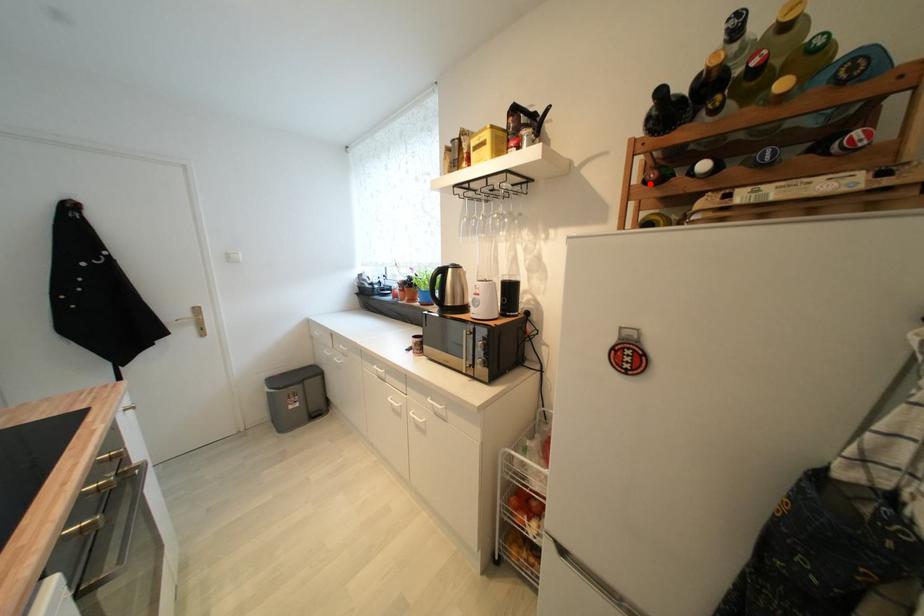
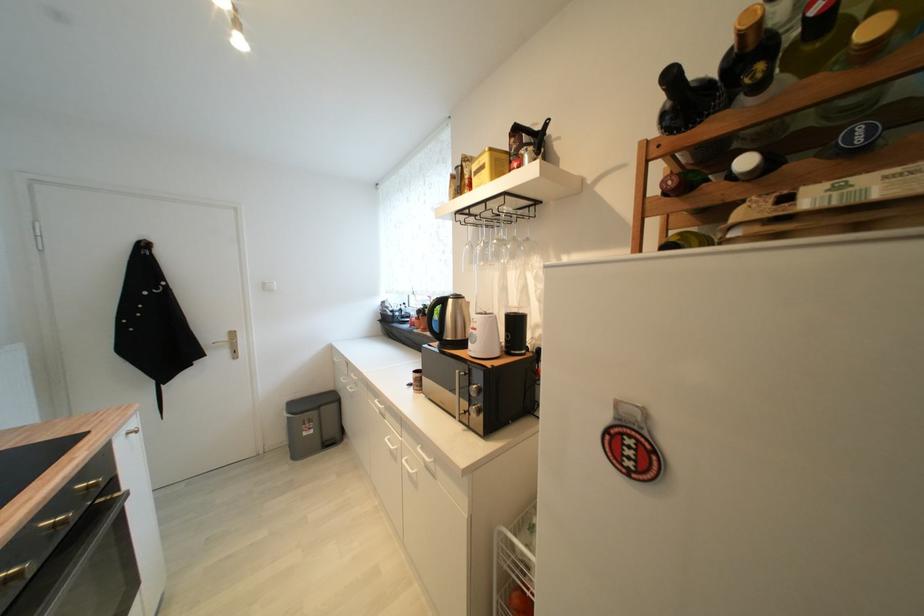
Find the pixel in the second image that matches the highlighted location in the first image.

(671, 195)